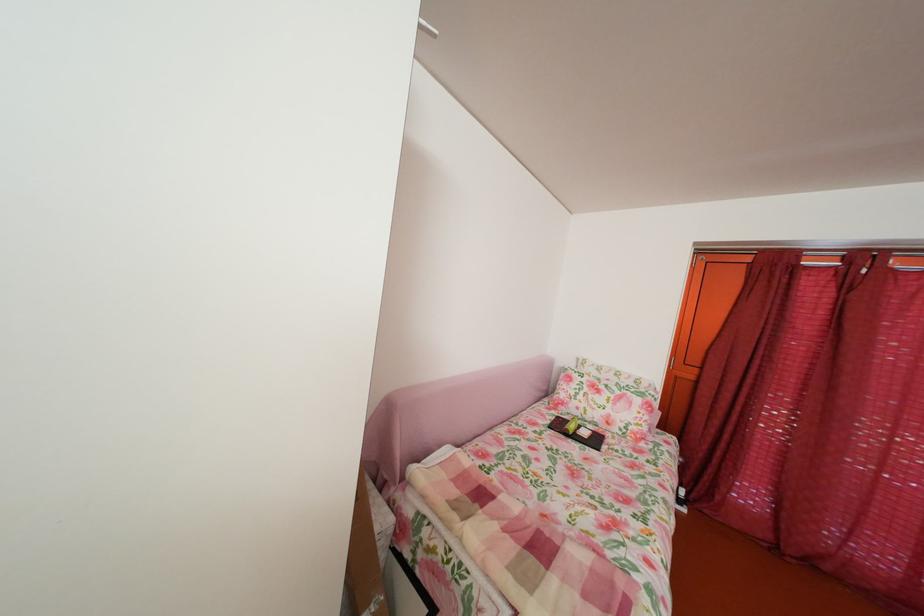
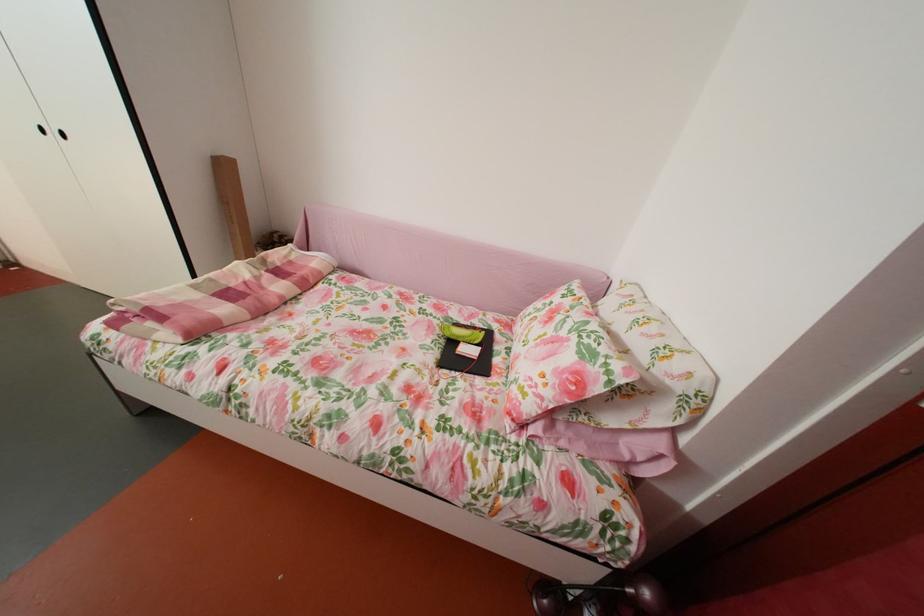
The point at (492, 517) is marked in the first image. Where is the corresponding point in the second image?

(274, 278)